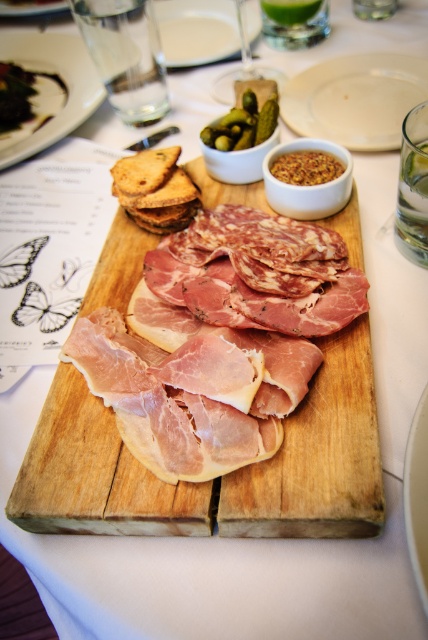
Based on the photo, is wooden cutting board at upper left wider than white glossy plate at center?

Yes, wooden cutting board at upper left is wider than white glossy plate at center.

Is wooden cutting board at upper left above white glossy plate at center?

Yes, wooden cutting board at upper left is above white glossy plate at center.

Is point (35, 35) in front of point (425, 513)?

No, it is behind (425, 513).

Identify the location of wooden cutting board at upper left. The height and width of the screenshot is (640, 428). (42, 92).

Does white matte plate at upper center have a larger size compared to white porcelain plate at upper center?

Actually, white matte plate at upper center might be smaller than white porcelain plate at upper center.

Does white matte plate at upper center appear on the left side of white porcelain plate at upper center?

Incorrect, white matte plate at upper center is not on the left side of white porcelain plate at upper center.

This screenshot has height=640, width=428. Identify the location of white matte plate at upper center. click(x=356, y=99).

Can you confirm if wooden cutting board at center is positioned above white matte plate at upper center?

Incorrect, wooden cutting board at center is not positioned above white matte plate at upper center.

Can you confirm if wooden cutting board at center is shorter than white matte plate at upper center?

In fact, wooden cutting board at center may be taller than white matte plate at upper center.

Does point (326, 504) come farther from viewer compared to point (320, 76)?

No, it is in front of (320, 76).

The height and width of the screenshot is (640, 428). What are the coordinates of `wooden cutting board at center` in the screenshot? It's located at (320, 458).